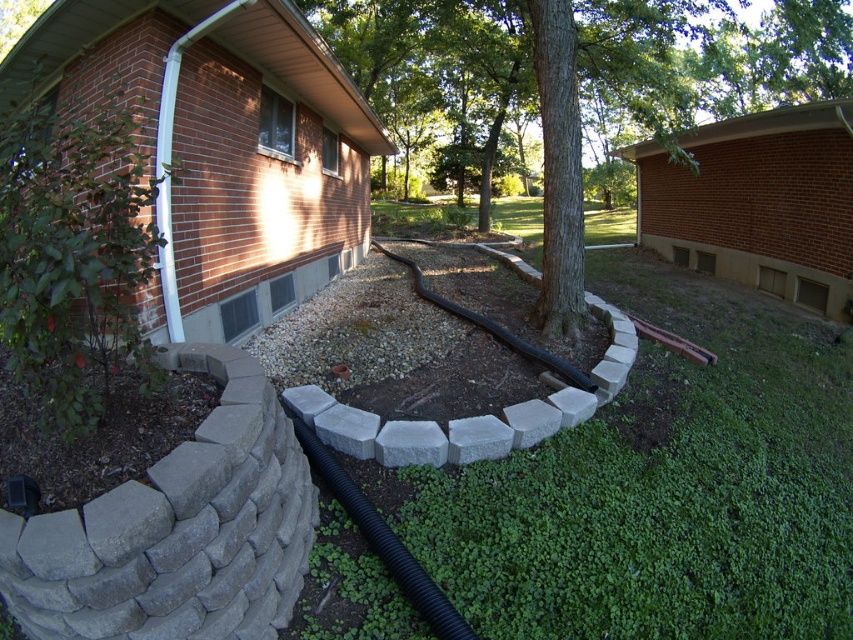
You are standing in the backyard and want to locate the black rubber hose at center. Based on the scene description, where would you find it in relation to the curved retaining wall?

The black rubber hose at center is located at point [381,540] in 2D coordinates, which is along the curve of the retaining wall.

You are a gardener planning to water plants around the green textured tree at center and the black rubber garden hose at center. Which object requires more water because of its size?

The green textured tree at center requires more water because it has a larger size compared to the black rubber garden hose at center.